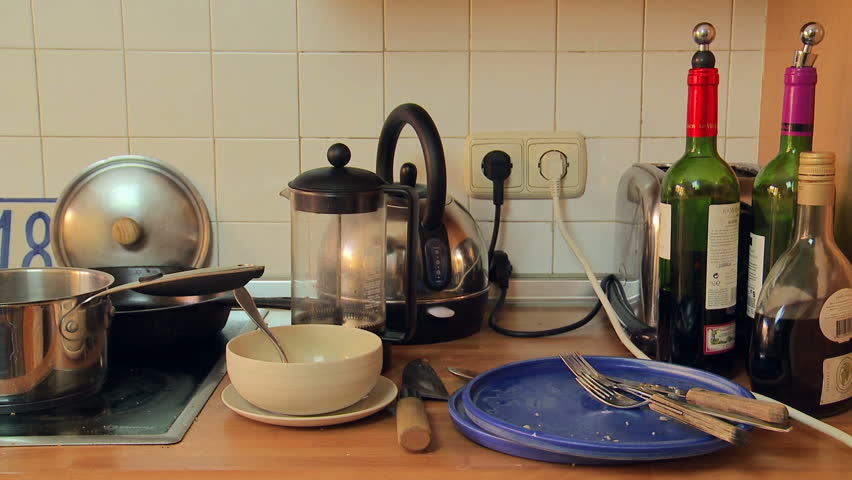
This screenshot has width=852, height=480. I want to click on counter, so click(354, 457).